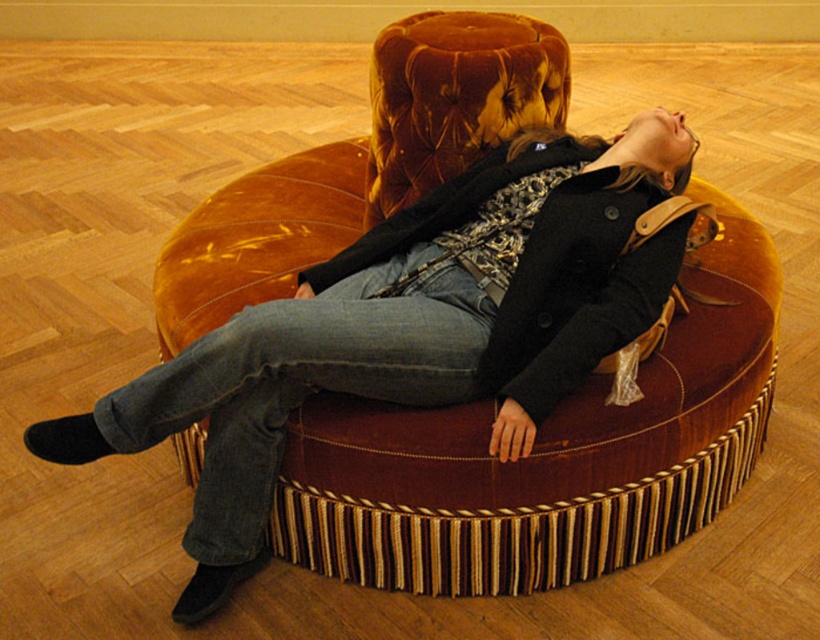
You are standing in the room and want to place a small plant between the two points, point [187,541] and point [213,353]. Which point should the plant be closer to in order to be closer to the viewer?

The plant should be closer to point [187,541] because it is further to the viewer than point [213,353].

You are helping organize a closet and need to determine if the matte black coat at center and denim at center can fit into a storage box that is 1 meter in length. Knowing their sizes, can both items fit side by side?

The matte black coat at center is bigger than denim at center. However, without specific measurements, it is impossible to determine if both can fit into a 1 meter box side by side.